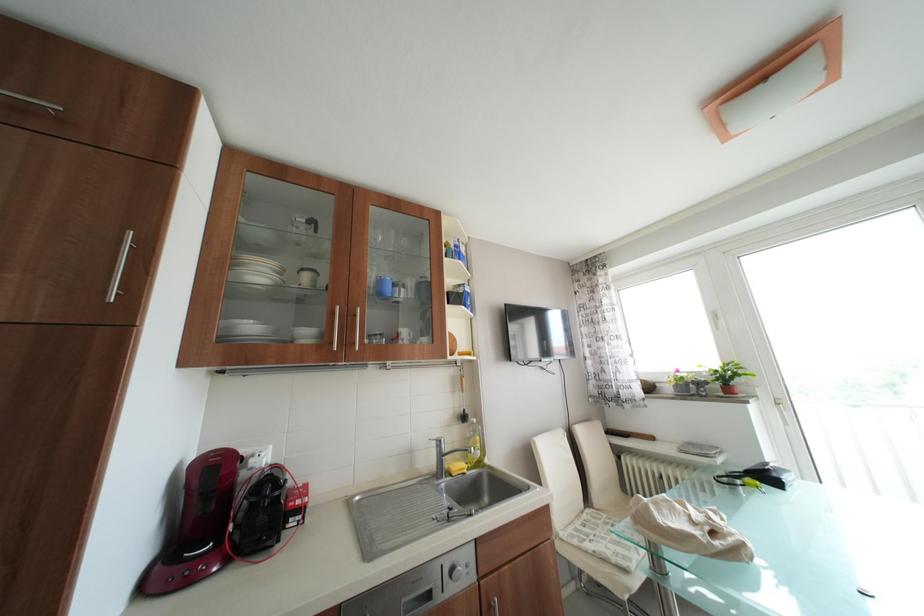
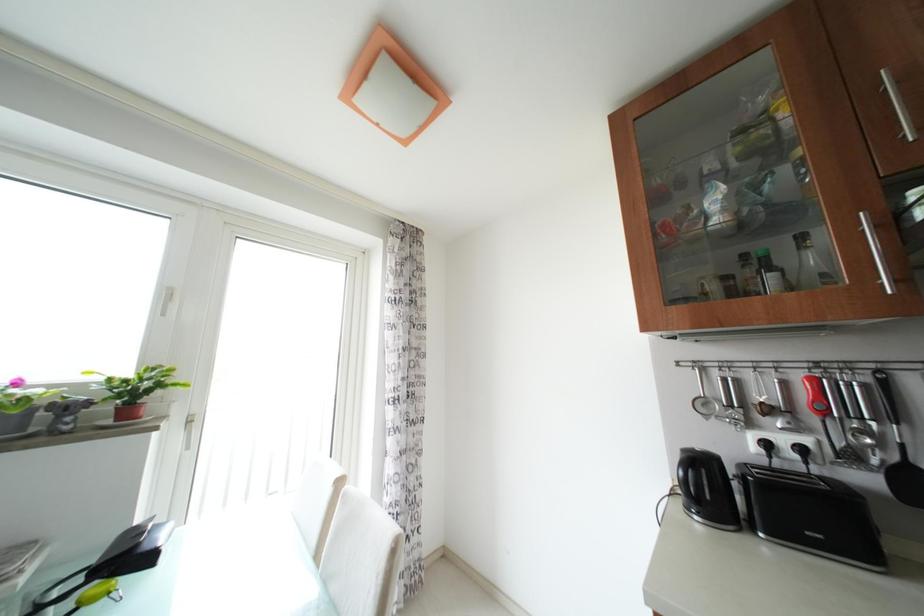
The first image is from the beginning of the video and the second image is from the end. How did the camera likely rotate when shooting the video?

The rotation direction of the camera is right-up.